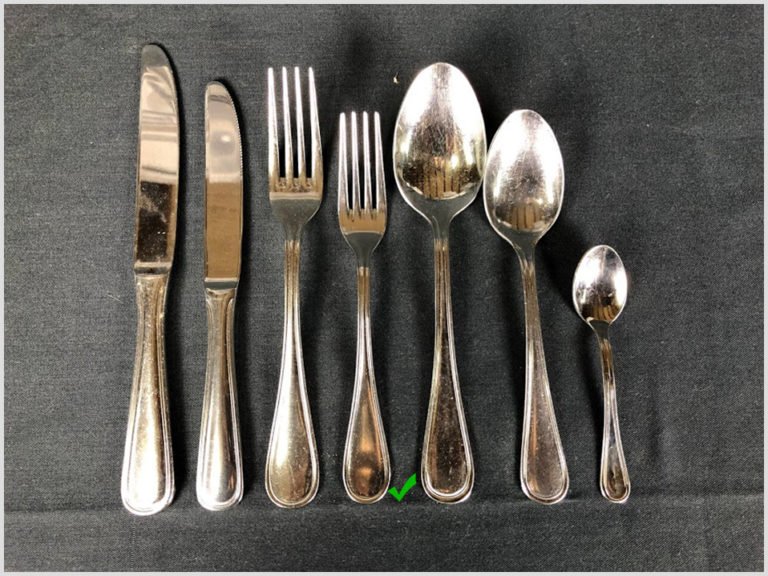
Find the location of a particular element. The image size is (768, 576). utensils is located at coordinates (601, 290), (512, 188), (438, 147), (366, 234), (300, 199), (214, 223), (174, 219).